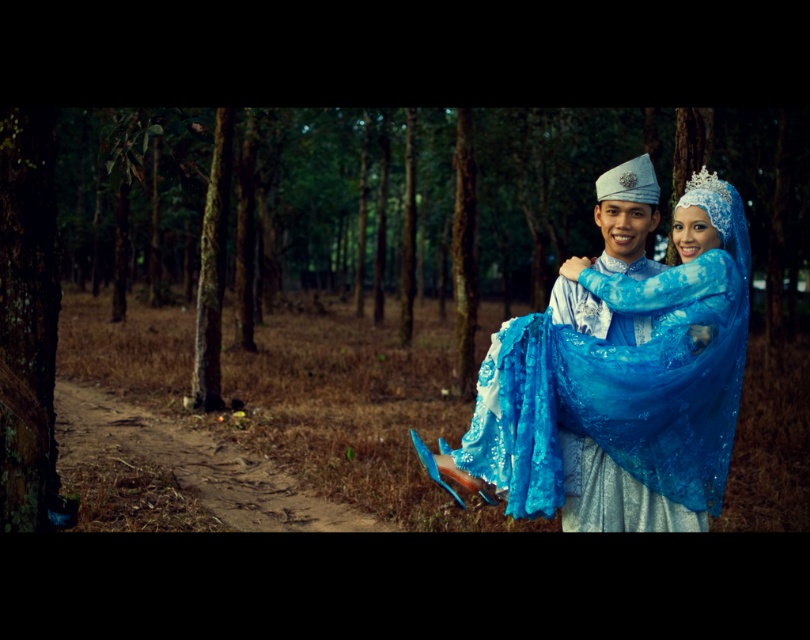
Question: Can you confirm if lustrous blue fabric dress at center is thinner than lustrous blue fabric at center?

Choices:
 (A) yes
 (B) no

Answer: (B)

Question: Is lustrous blue fabric dress at center in front of lustrous blue fabric at center?

Choices:
 (A) no
 (B) yes

Answer: (B)

Question: Can you confirm if green matte trees at center is positioned to the right of lustrous blue fabric dress at center?

Choices:
 (A) yes
 (B) no

Answer: (A)

Question: Which object is positioned closest to the lustrous blue fabric at center?

Choices:
 (A) green matte trees at center
 (B) lustrous blue fabric dress at center

Answer: (B)

Question: Estimate the real-world distances between objects in this image. Which object is farther from the lustrous blue fabric at center?

Choices:
 (A) lustrous blue fabric dress at center
 (B) green matte trees at center

Answer: (B)

Question: Among these points, which one is farthest from the camera?

Choices:
 (A) (574, 243)
 (B) (654, 512)

Answer: (A)